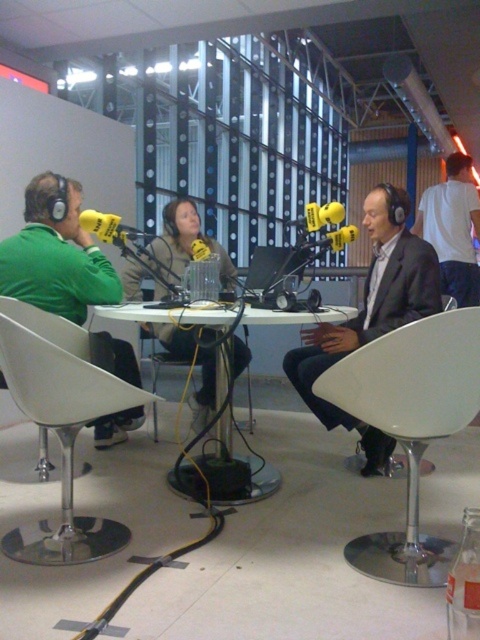
You are a technician setting up a microphone stand that requires 18 inches of space between the stand and the table edge. You have a matte black suit at center and a white plastic table at center in view. Can the microphone stand be placed between them without violating the space requirement?

The distance between the matte black suit at center and the white plastic table at center is 14.43 inches, which is less than the required 18 inches. Therefore, the microphone stand cannot be placed between them without violating the space requirement.

You are standing in front of the recording setup and need to locate the matte black jacket at center. According to the coordinates provided, where exactly would you find it?

The matte black jacket at center is located at coordinates point [186,243].

You are a photographer positioned behind the recording table. You need to take a photo that captures both the matte black jacket at center and the white cotton shirt at right clearly. Which one will appear larger in the photo?

The matte black jacket at center will appear larger in the photo because it is closer to the viewer than the white cotton shirt at right.